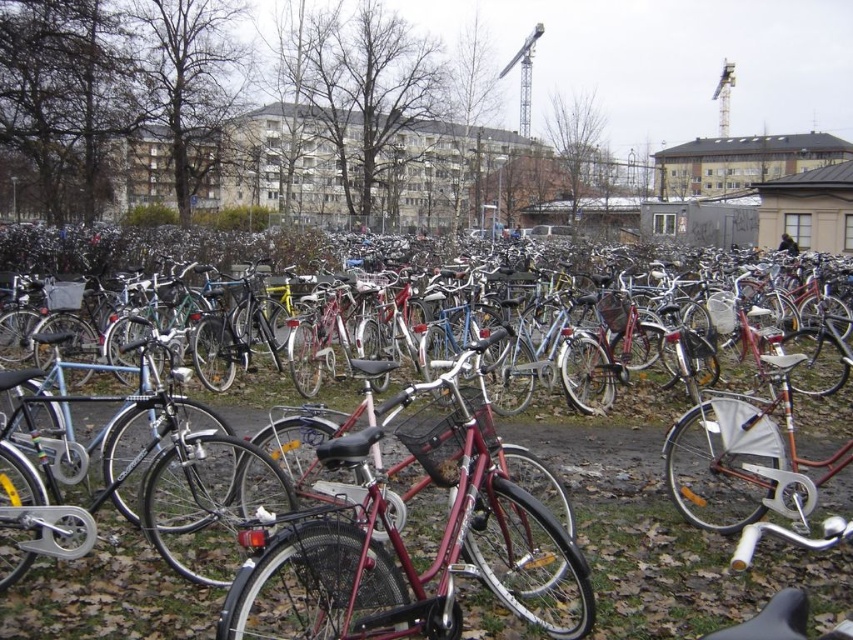
Question: Which object appears farthest from the camera in this image?

Choices:
 (A) shiny metallic bicycle at center
 (B) shiny red bicycle at center
 (C) metallic bicycles at center
 (D) shiny black bicycle at center

Answer: (A)

Question: Does metallic bicycles at center appear on the left side of shiny red bicycle at center?

Choices:
 (A) yes
 (B) no

Answer: (B)

Question: Considering the relative positions of shiny black bicycle at center and shiny metallic bicycle at center in the image provided, where is shiny black bicycle at center located with respect to shiny metallic bicycle at center?

Choices:
 (A) right
 (B) left

Answer: (B)

Question: Is shiny black bicycle at center thinner than shiny metallic bicycle at center?

Choices:
 (A) yes
 (B) no

Answer: (A)

Question: Among these objects, which one is farthest from the camera?

Choices:
 (A) shiny metallic bicycle at center
 (B) shiny black bicycle at center
 (C) metallic bicycles at center
 (D) shiny red bicycle at center

Answer: (A)

Question: Which of these objects is positioned farthest from the metallic bicycles at center?

Choices:
 (A) shiny black bicycle at center
 (B) shiny red bicycle at center

Answer: (A)